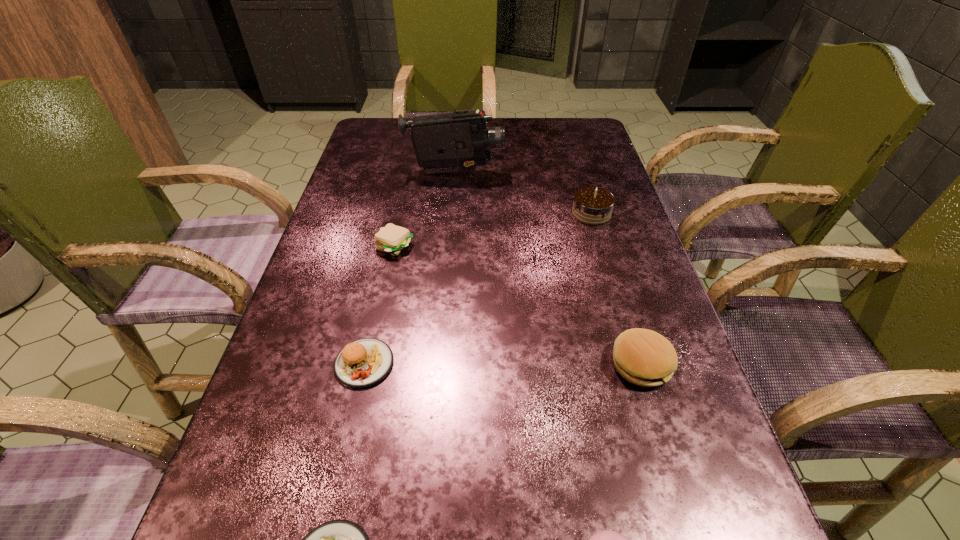
This screenshot has width=960, height=540. Identify the location of the tallest object. (450, 142).

Identify the location of the farthest object. (450, 142).

Where is `the second farthest object`? This screenshot has width=960, height=540. the second farthest object is located at coordinates 592,205.

This screenshot has width=960, height=540. In order to click on chocolate cake in this screenshot , I will do `click(592, 205)`.

Where is `the rightmost patty (food)`? the rightmost patty (food) is located at coordinates (643, 357).

At what (x,y) coordinates should I click in order to perform the action: click on the farthest patty (food). Please return your answer as a coordinate pair (x, y). This screenshot has height=540, width=960. Looking at the image, I should click on (392, 239).

The height and width of the screenshot is (540, 960). Find the location of `the third tallest patty (food)`. the third tallest patty (food) is located at coordinates (392, 239).

Identify the location of free spot located on the front-facing side of the tallest object. (588, 173).

Where is `vacant space located on the left of the sixth shortest object`? vacant space located on the left of the sixth shortest object is located at coordinates (426, 213).

Find the location of a particular element. free location located 0.310m on the back of the rightmost patty (food) is located at coordinates (601, 233).